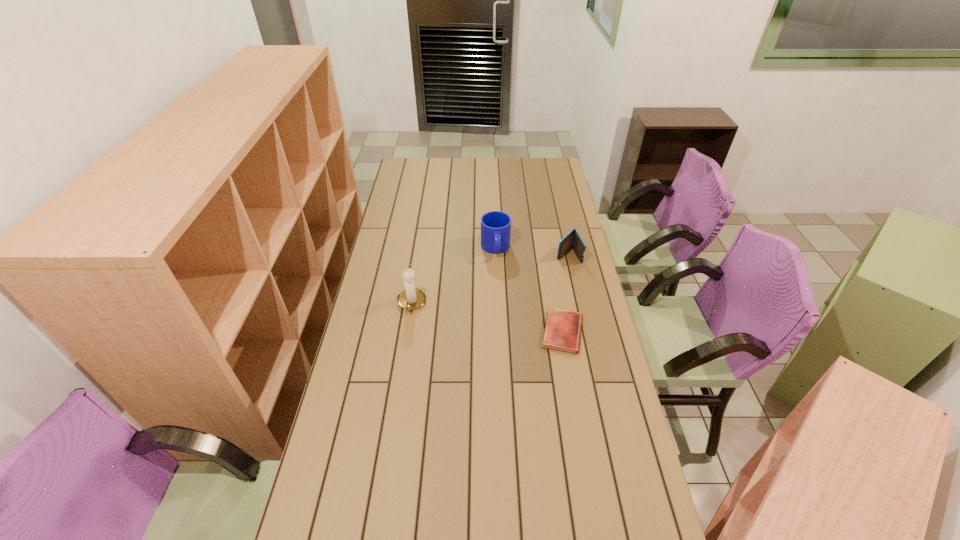
Where is `vacant space located 0.150m on the side with the handle of the mug`? Image resolution: width=960 pixels, height=540 pixels. vacant space located 0.150m on the side with the handle of the mug is located at coordinates (499, 287).

I want to click on vacant space situated on the exterior surface of the third tallest object, so click(547, 275).

The height and width of the screenshot is (540, 960). I want to click on vacant space located 0.280m on the exterior surface of the third tallest object, so click(522, 298).

What are the coordinates of `vacant space located on the exterior surface of the third tallest object` in the screenshot? It's located at (512, 308).

This screenshot has height=540, width=960. I want to click on object that is at the left edge, so click(411, 298).

At what (x,y) coordinates should I click in order to perform the action: click on diary positioned at the right edge. Please return your answer as a coordinate pair (x, y). This screenshot has width=960, height=540. Looking at the image, I should click on (x=562, y=332).

Image resolution: width=960 pixels, height=540 pixels. I want to click on wallet that is positioned at the right edge, so click(x=573, y=239).

In the image, there is a desktop. Where is `vacant space at the far edge`? vacant space at the far edge is located at coordinates (449, 158).

Locate an element on the screen. This screenshot has width=960, height=540. free space at the near edge of the desktop is located at coordinates 457,516.

Find the location of a particular element. The image size is (960, 540). vacant space at the left edge of the desktop is located at coordinates (415, 204).